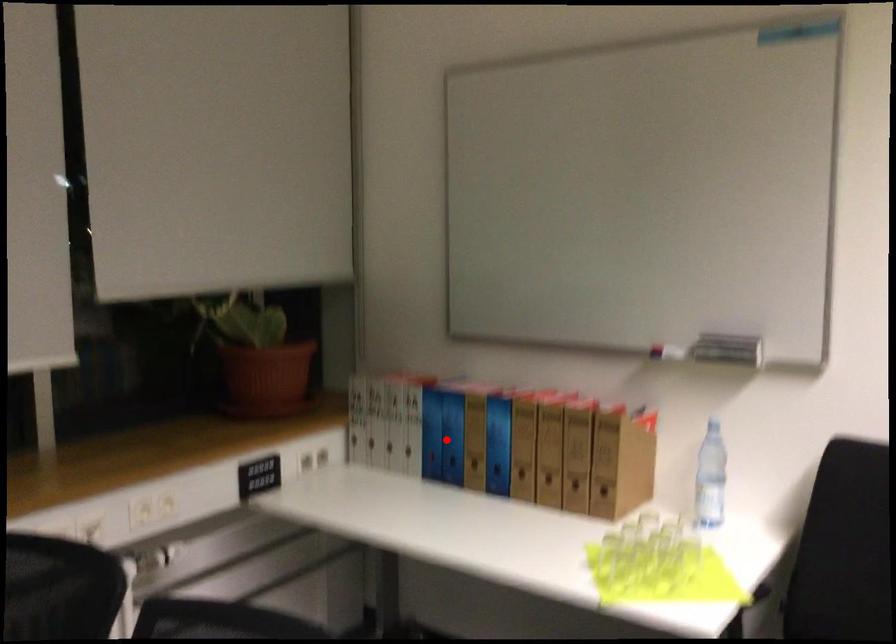
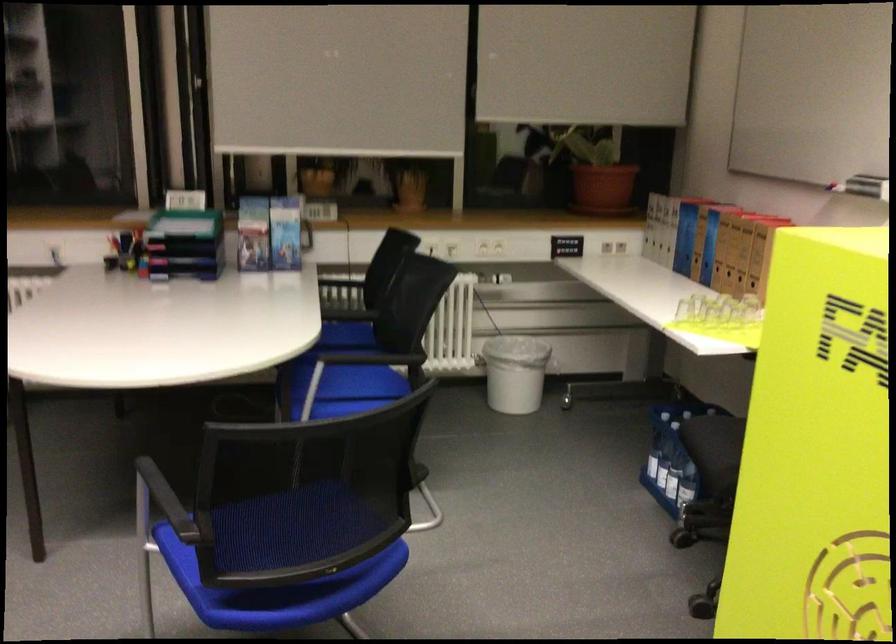
In the second image, find the point that corresponds to the highlighted location in the first image.

(685, 238)